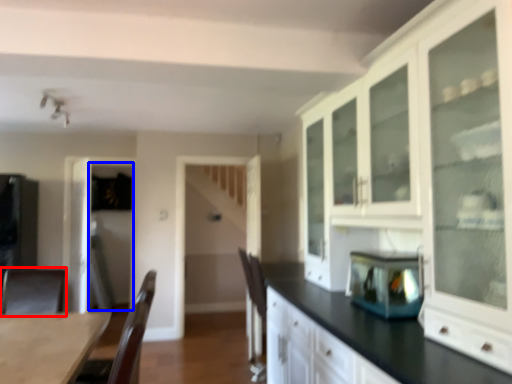
Question: Which object is further to the camera taking this photo, armchair (highlighted by a red box) or glass door (highlighted by a blue box)?

Choices:
 (A) armchair
 (B) glass door

Answer: (B)